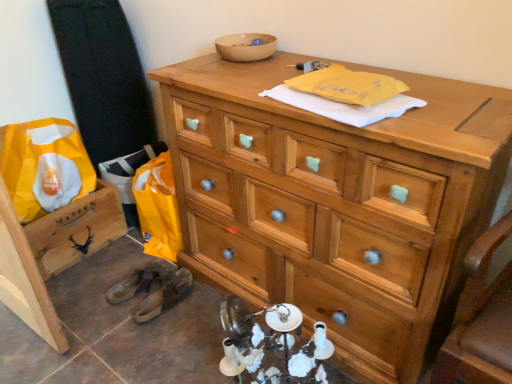
Locate an element on the screen. free space to the right of wooden bowl at upper center is located at coordinates (302, 53).